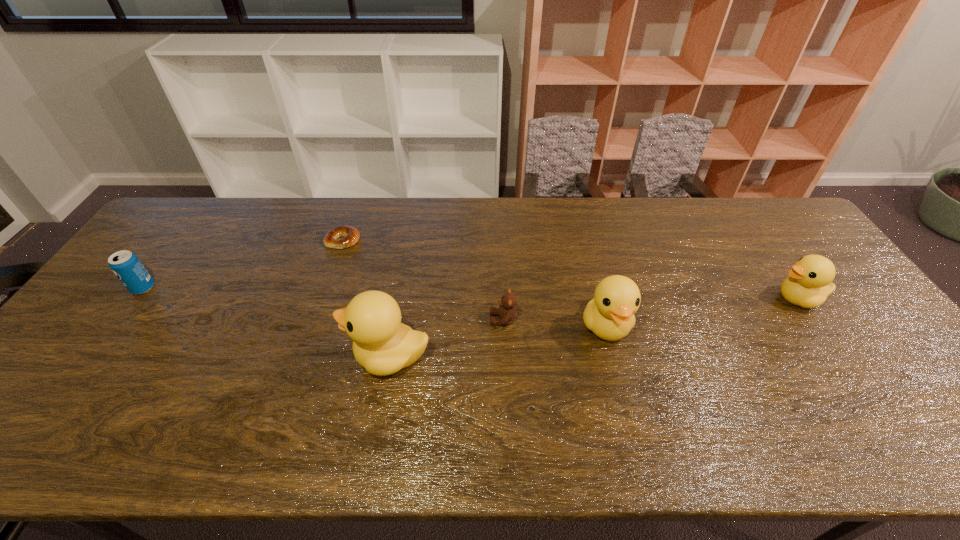
Please point out where to position a new duck on the left to maintain spacing. Please provide its 2D coordinates. Your answer should be formatted as a tuple, i.e. [(x, y)], where the tuple contains the x and y coordinates of a point satisfying the conditions above.

[(143, 392)]